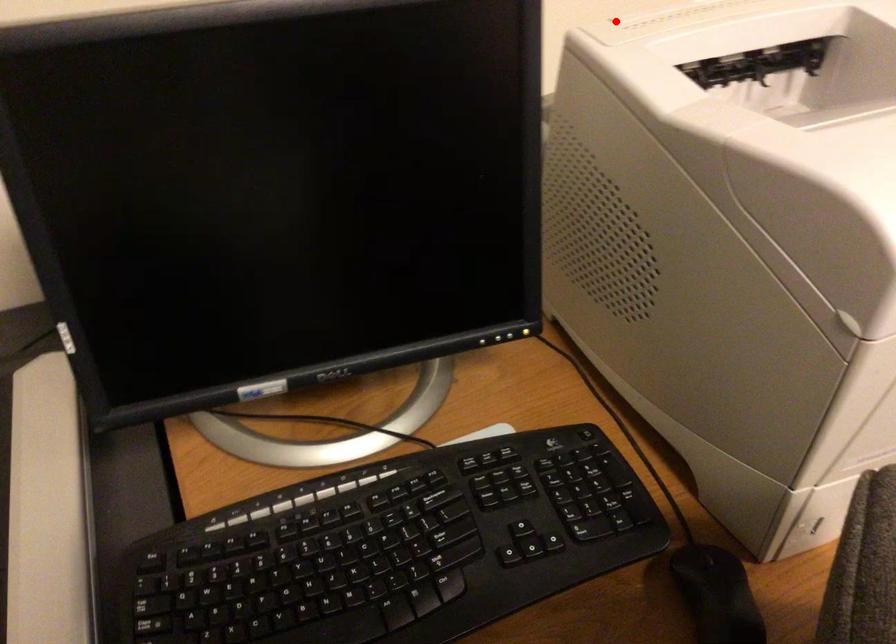
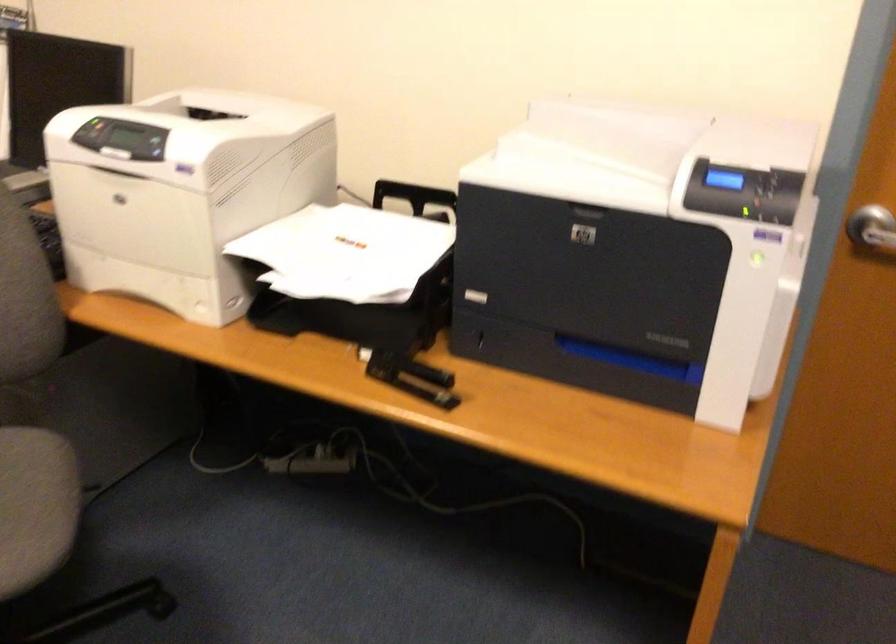
Question: I am providing you with two images of the same scene from different viewpoints. A red point is marked on the first image. Can you still see the location of the red point in image 2?

Choices:
 (A) Yes
 (B) No

Answer: (B)